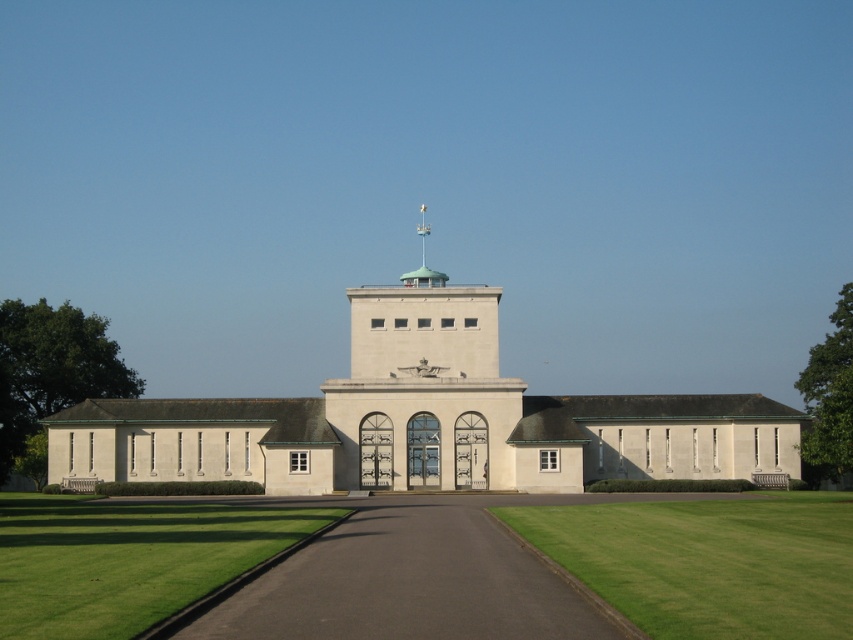
You are standing at the entrance of the building and want to take a photo of the point at coordinates point [633,598]. If your camera can focus on objects up to 20 meters away, will you be able to capture the point clearly?

The point [633,598] is 21.79 meters away from the camera, which is beyond the camera focus range of 20 meters. Therefore, the point cannot be captured clearly.

From the picture: You are standing at the entrance of the building and see two patches of green grass at center and green grass at lower left. Which one is located to the right side when facing the building?

The green grass at center is positioned on the right side of green grass at lower left, so when facing the building, the green grass at center is to the right side of the green grass at lower left.

You are standing at the entrance of the building and want to locate the white stone bell tower at center. According to the coordinates provided, in which direction should you look to find it?

The white stone bell tower at center is located at coordinates point [422,388], so you should look towards the center of the building to find it.